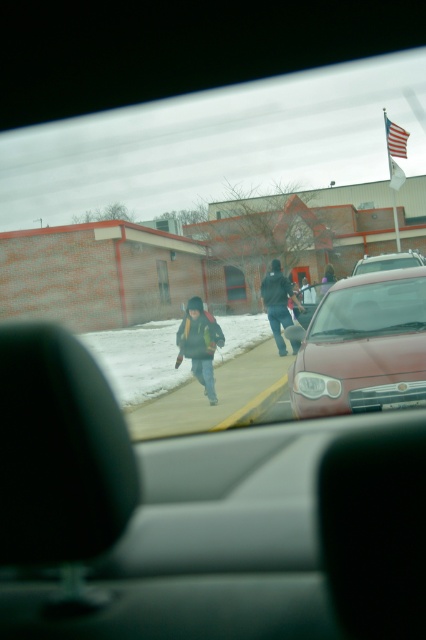
Is clear glass windshield at center to the left of dark gray hoodie at center from the viewer's perspective?

Correct, you'll find clear glass windshield at center to the left of dark gray hoodie at center.

Is clear glass windshield at center behind dark gray hoodie at center?

No.

At what (x,y) coordinates should I click in order to perform the action: click on clear glass windshield at center. Please return your answer as a coordinate pair (x, y). This screenshot has height=640, width=426. Looking at the image, I should click on (371, 308).

What do you see at coordinates (362, 346) in the screenshot?
I see `matte red car at center` at bounding box center [362, 346].

Can you confirm if matte red car at center is positioned to the right of metallic silver sedan at center?

No, matte red car at center is not to the right of metallic silver sedan at center.

Which is in front, point (382, 272) or point (371, 259)?

Point (382, 272) is more forward.

At what (x,y) coordinates should I click in order to perform the action: click on matte red car at center. Please return your answer as a coordinate pair (x, y). Looking at the image, I should click on (362, 346).

Who is more distant from viewer, (402, 284) or (216, 337)?

Positioned behind is point (216, 337).

Identify the location of matte red car at center. (362, 346).

Image resolution: width=426 pixels, height=640 pixels. In order to click on matte red car at center in this screenshot , I will do `click(362, 346)`.